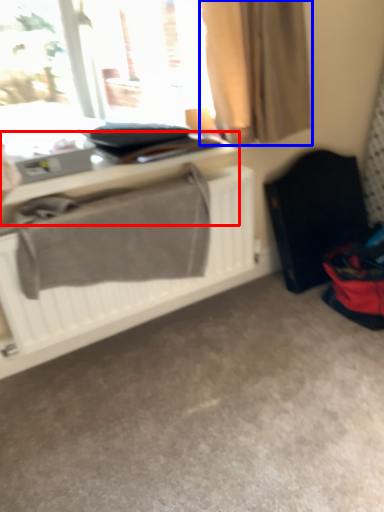
Question: Which of the following is the farthest to the observer, table (highlighted by a red box) or curtain (highlighted by a blue box)?

Choices:
 (A) table
 (B) curtain

Answer: (A)